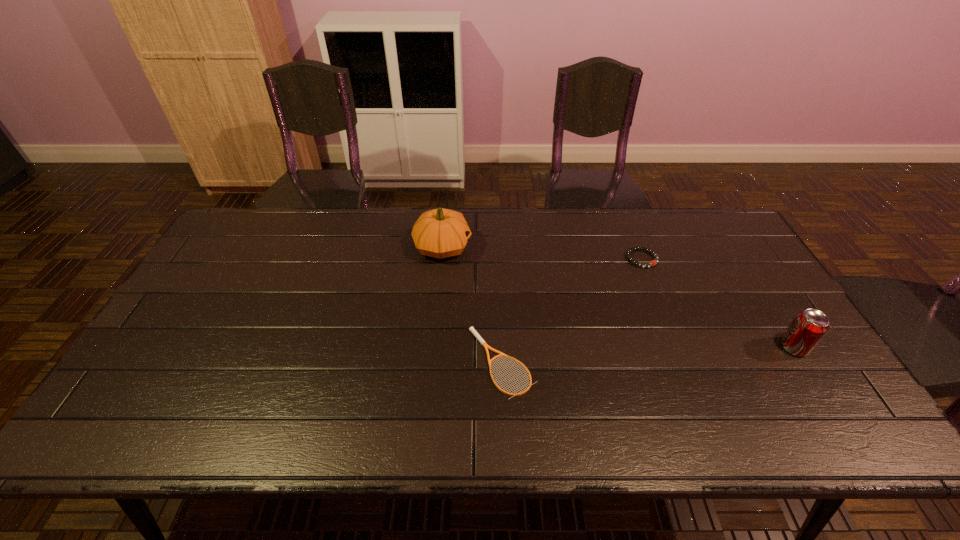
Locate an element on the screen. The image size is (960, 540). gourd at the far edge is located at coordinates (439, 233).

Identify the location of bracelet located in the far edge section of the desktop. (628, 254).

Identify the location of object that is at the right edge. (807, 329).

This screenshot has height=540, width=960. In the image, there is a desktop. In order to click on free region at the far edge in this screenshot , I will do click(472, 241).

Locate an element on the screen. The height and width of the screenshot is (540, 960). free space at the near edge is located at coordinates (735, 411).

The width and height of the screenshot is (960, 540). I want to click on vacant space at the left edge of the desktop, so click(x=238, y=268).

You are a GUI agent. You are given a task and a screenshot of the screen. Output one action in this format:
    pyautogui.click(x=<x>, y=<y>)
    Task: Click on the vacant area that lies between the gourd and the rightmost object
    This screenshot has height=540, width=960.
    Given the screenshot: What is the action you would take?
    tap(618, 297)

Locate an element on the screen. vacant point located between the tennis racket and the third shortest object is located at coordinates (648, 355).

You are a GUI agent. You are given a task and a screenshot of the screen. Output one action in this format:
    pyautogui.click(x=<x>, y=<y>)
    Task: Click on the free space that is in between the gourd and the second object from right to left
    
    Given the screenshot: What is the action you would take?
    pyautogui.click(x=542, y=253)

Locate an element on the screen. The height and width of the screenshot is (540, 960). free space between the tennis racket and the gourd is located at coordinates (472, 305).